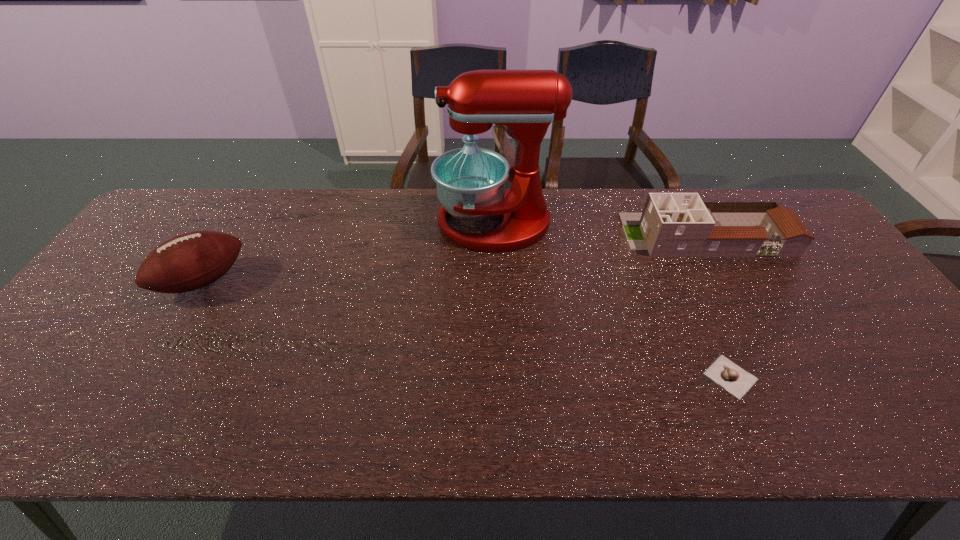
Locate an element on the screen. This screenshot has width=960, height=540. vacant position at the near edge of the desktop is located at coordinates (272, 440).

At what (x,y) coordinates should I click in order to perform the action: click on vacant space at the left edge of the desktop. Please return your answer as a coordinate pair (x, y). Looking at the image, I should click on (122, 307).

This screenshot has height=540, width=960. What are the coordinates of `blank space at the right edge of the desktop` in the screenshot? It's located at (893, 390).

Image resolution: width=960 pixels, height=540 pixels. I want to click on vacant space at the far left corner of the desktop, so click(x=156, y=234).

This screenshot has width=960, height=540. In the image, there is a desktop. Find the location of `vacant area at the far right corner`. vacant area at the far right corner is located at coordinates (765, 201).

Locate an element on the screen. This screenshot has width=960, height=540. empty space between the third object from right to left and the dollhouse is located at coordinates (600, 229).

I want to click on free space between the dollhouse and the leftmost object, so click(454, 258).

You are a GUI agent. You are given a task and a screenshot of the screen. Output one action in this format:
    pyautogui.click(x=<x>, y=<y>)
    Task: Click on the empty space between the football (American) and the tallest object
    This screenshot has height=540, width=960.
    Given the screenshot: What is the action you would take?
    pyautogui.click(x=348, y=252)

You are a GUI agent. You are given a task and a screenshot of the screen. Output one action in this format:
    pyautogui.click(x=<x>, y=<y>)
    Task: Click on the vacant point located between the garlic and the dollhouse
    The height and width of the screenshot is (540, 960).
    Given the screenshot: What is the action you would take?
    pyautogui.click(x=718, y=306)

I want to click on free space between the garlic and the tallest object, so click(612, 300).